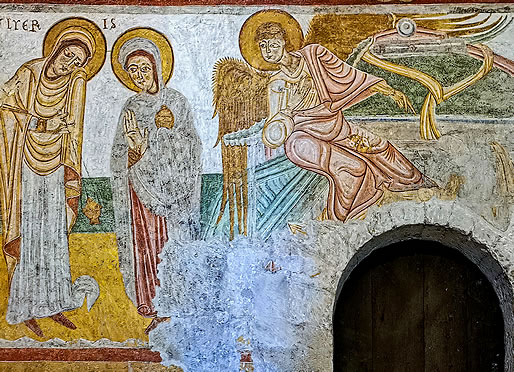
Locate an element on the screen. archway is located at coordinates (403, 231).